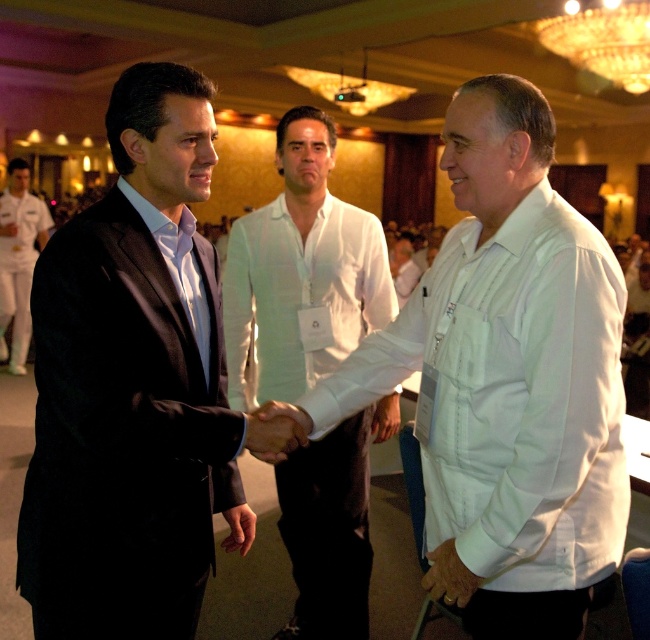
Question: Which point is closer to the camera taking this photo?

Choices:
 (A) (53, 550)
 (B) (21, 352)
 (C) (268, 328)

Answer: (A)

Question: Does matte black suit at left appear under white textured shirt at center?

Choices:
 (A) no
 (B) yes

Answer: (A)

Question: Is matte black suit at left thinner than white cotton shirt at left?

Choices:
 (A) no
 (B) yes

Answer: (A)

Question: Does white cotton shirt at center have a larger size compared to white cotton shirt at left?

Choices:
 (A) no
 (B) yes

Answer: (A)

Question: Which point is farther from the camera taking this photo?

Choices:
 (A) (44, 621)
 (B) (255, 390)
 (C) (16, 310)

Answer: (C)

Question: Which of these objects is positioned closest to the matte black suit at left?

Choices:
 (A) white cotton shirt at center
 (B) white textured shirt at center
 (C) white cotton shirt at left

Answer: (A)